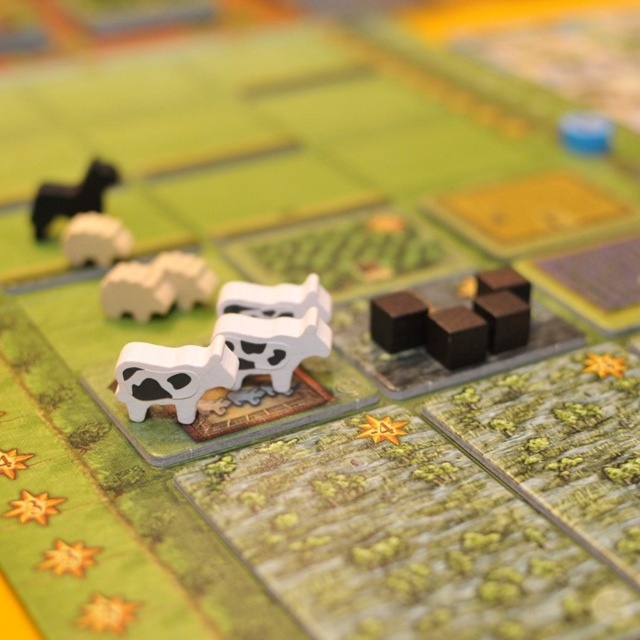
Question: From the image, what is the correct spatial relationship of shiny dark brown cubes at center right in relation to white matte cow at upper left?

Choices:
 (A) below
 (B) above

Answer: (A)

Question: Does black matte horse at left appear under white matte cow at upper left?

Choices:
 (A) no
 (B) yes

Answer: (A)

Question: Which object is closer to the camera taking this photo?

Choices:
 (A) white matte cow at center
 (B) black matte horse at left

Answer: (A)

Question: Can you confirm if shiny dark brown cubes at center right is wider than black matte horse at left?

Choices:
 (A) no
 (B) yes

Answer: (B)

Question: Among these objects, which one is nearest to the camera?

Choices:
 (A) black matte horse at left
 (B) shiny dark brown cubes at center right
 (C) white matte cow at upper left
 (D) white matte cow at center

Answer: (D)

Question: Which object is the closest to the white matte cow at center?

Choices:
 (A) black matte horse at left
 (B) white matte cow at upper left

Answer: (B)